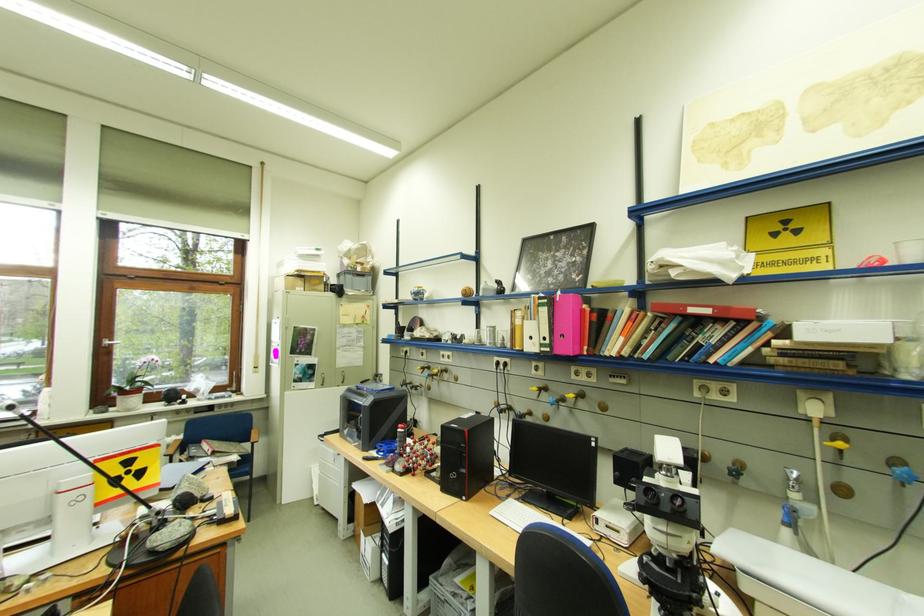
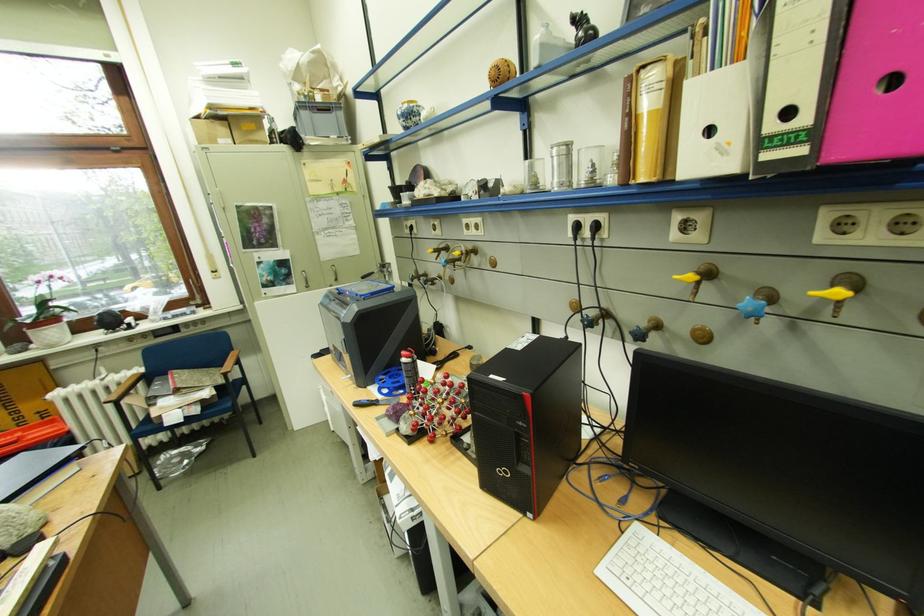
Locate, in the second image, the point that corresponds to (435,370) in the first image.

(453, 253)